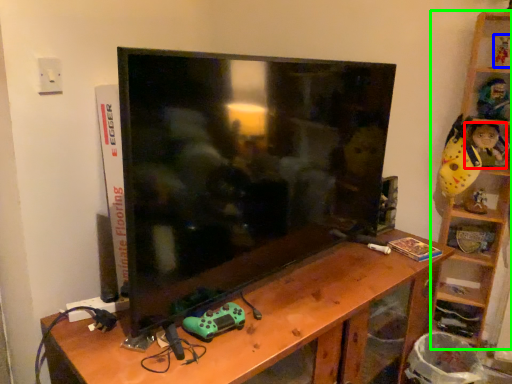
Question: Which object is positioned closest to toy (highlighted by a red box)? Select from toy (highlighted by a blue box) and shelf (highlighted by a green box).

Choices:
 (A) toy
 (B) shelf

Answer: (B)